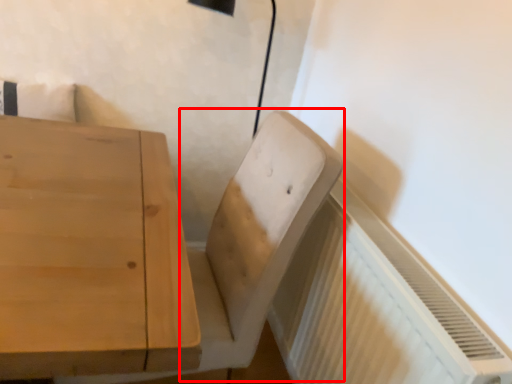
Question: From the image, what is the correct spatial relationship of swivel chair (annotated by the red box) in relation to radiator?

Choices:
 (A) right
 (B) left

Answer: (B)